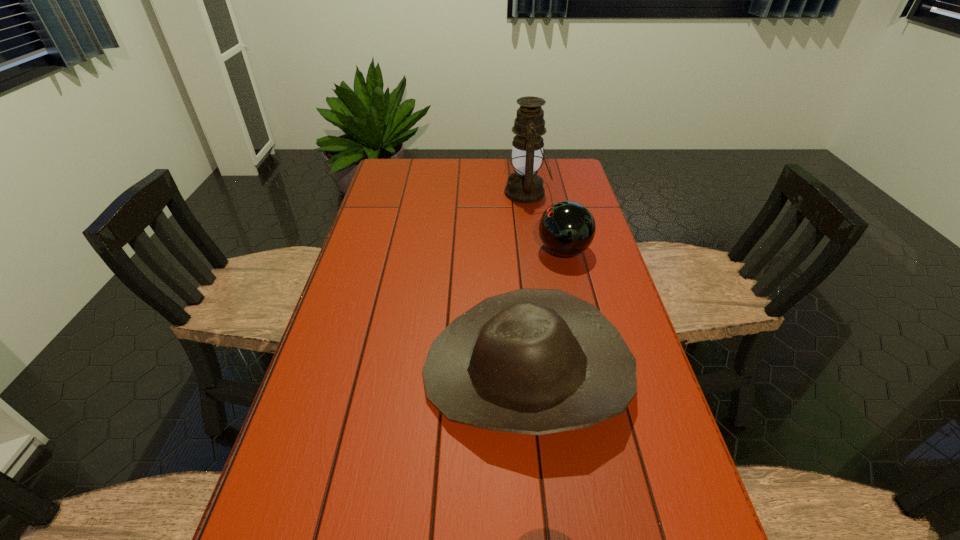
Image resolution: width=960 pixels, height=540 pixels. Identify the location of oil lamp. (524, 186).

This screenshot has width=960, height=540. Find the location of `the farthest object`. the farthest object is located at coordinates (524, 186).

Where is `the nearest object`? The width and height of the screenshot is (960, 540). the nearest object is located at coordinates (533, 361).

Identify the location of bowling ball. (567, 228).

Where is `free space located 0.380m on the left of the farthest object`? This screenshot has width=960, height=540. free space located 0.380m on the left of the farthest object is located at coordinates (398, 193).

The width and height of the screenshot is (960, 540). What are the coordinates of `vacant region located 0.200m on the back of the nearest object` in the screenshot? It's located at (516, 261).

Image resolution: width=960 pixels, height=540 pixels. I want to click on free space located on the surface of the bowling ball near the finger holes, so click(x=438, y=251).

Find the location of `vacant space located on the surface of the bowling ball near the finger holes`. vacant space located on the surface of the bowling ball near the finger holes is located at coordinates (464, 251).

This screenshot has width=960, height=540. Identify the location of vacant region located 0.370m on the surface of the bowling ball near the finger holes. (414, 251).

Find the location of a particular element. The width and height of the screenshot is (960, 540). object situated at the far edge is located at coordinates (524, 186).